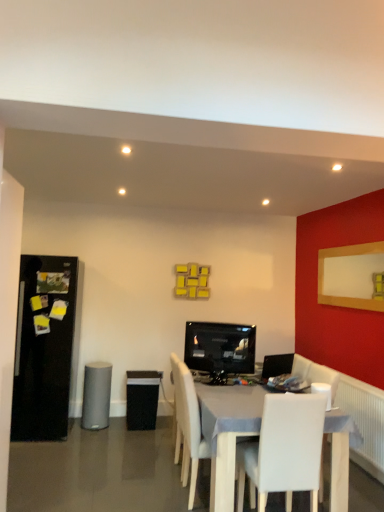
Question: Is black mesh speaker at center, positioned as the 1th speaker in back-to-front order, in front of or behind gray matte speaker at lower left, placed as the 3th speaker when sorted from right to left, in the image?

Choices:
 (A) behind
 (B) front

Answer: (A)

Question: Is black mesh speaker at center, acting as the 2th speaker starting from the right, inside or outside of gray matte speaker at lower left, placed as the 3th speaker when sorted from right to left?

Choices:
 (A) outside
 (B) inside

Answer: (A)

Question: Which of these objects is positioned farthest from the black glossy refrigerator at left?

Choices:
 (A) gray matte speaker at lower left, placed as the 3th speaker when sorted from right to left
 (B) white leather chair at center, the 2th chair when ordered from back to front
 (C) black glossy tv at center
 (D) white plastic speaker at lower right, the third speaker when ordered from left to right
 (E) white wooden table at center

Answer: (D)

Question: Estimate the real-world distances between objects in this image. Which object is closer to the black glossy refrigerator at left?

Choices:
 (A) white leather chair at center, acting as the first chair starting from the front
 (B) black mesh speaker at center, positioned as the 1th speaker in back-to-front order
 (C) white wooden table at center
 (D) white plastic speaker at lower right, placed as the 1th speaker when sorted from front to back
 (E) black glossy tv at center

Answer: (B)